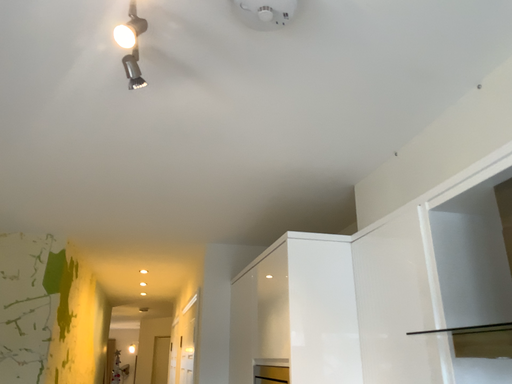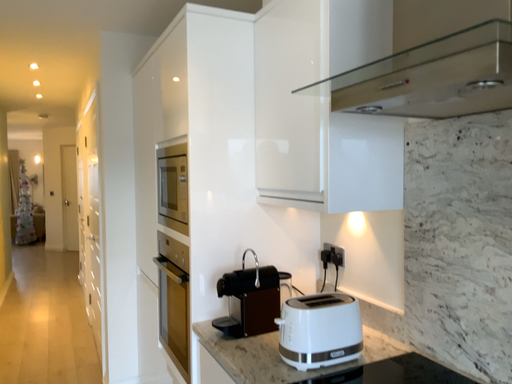
Question: Which way did the camera rotate in the video?

Choices:
 (A) rotated right
 (B) rotated left

Answer: (A)